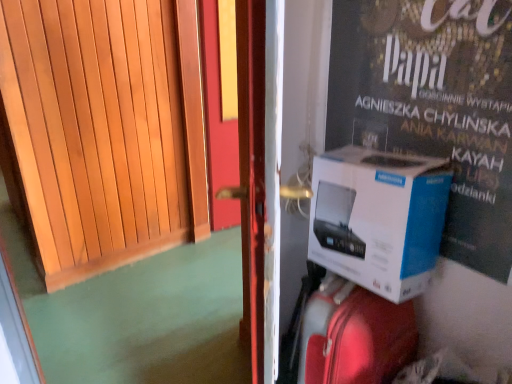
Question: Is shiny red suitcase at center bigger or smaller than wooden door at left?

Choices:
 (A) big
 (B) small

Answer: (B)

Question: In terms of height, does shiny red suitcase at center look taller or shorter compared to wooden door at left?

Choices:
 (A) short
 (B) tall

Answer: (A)

Question: Considering the real-world distances, which object is farthest from the wooden door at left?

Choices:
 (A) white cardboard box at right
 (B) shiny red suitcase at center
 (C) white cardboard box at right

Answer: (B)

Question: Estimate the real-world distances between objects in this image. Which object is closer to the white cardboard box at right?

Choices:
 (A) white cardboard box at right
 (B) shiny red suitcase at center
 (C) wooden door at left

Answer: (B)